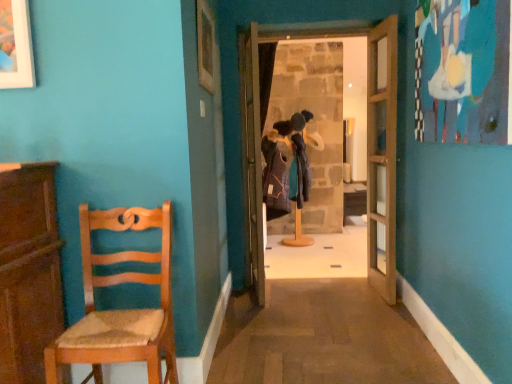
Question: Considering the relative sizes of wooden door at center, the 1th door from the right, and wooden table at center in the image provided, is wooden door at center, the 1th door from the right, bigger than wooden table at center?

Choices:
 (A) no
 (B) yes

Answer: (A)

Question: Is wooden door at center, the 1th door from the right, to the right of wooden table at center from the viewer's perspective?

Choices:
 (A) yes
 (B) no

Answer: (B)

Question: Does wooden door at center, the 1th door from the right, have a greater height compared to wooden table at center?

Choices:
 (A) no
 (B) yes

Answer: (B)

Question: Could wooden table at center be considered to be inside wooden door at center, the 1th door from the right?

Choices:
 (A) no
 (B) yes

Answer: (A)

Question: Does wooden door at center, the 1th door from the right, come in front of wooden table at center?

Choices:
 (A) yes
 (B) no

Answer: (A)

Question: Would you say woven wood chair at left is inside or outside wooden picture frame at upper center?

Choices:
 (A) outside
 (B) inside

Answer: (A)

Question: Considering their positions, is woven wood chair at left located in front of or behind wooden picture frame at upper center?

Choices:
 (A) front
 (B) behind

Answer: (A)

Question: Looking at their shapes, would you say woven wood chair at left is wider or thinner than wooden picture frame at upper center?

Choices:
 (A) wide
 (B) thin

Answer: (A)

Question: In terms of height, does woven wood chair at left look taller or shorter compared to wooden picture frame at upper center?

Choices:
 (A) tall
 (B) short

Answer: (A)

Question: Is wooden picture frame at upper center bigger or smaller than woven wood chair at left?

Choices:
 (A) big
 (B) small

Answer: (B)

Question: From a real-world perspective, relative to woven wood chair at left, is wooden picture frame at upper center vertically above or below?

Choices:
 (A) below
 (B) above

Answer: (B)

Question: Is wooden picture frame at upper center in front of or behind woven wood chair at left in the image?

Choices:
 (A) behind
 (B) front

Answer: (A)

Question: From the image's perspective, is wooden picture frame at upper center above or below woven wood chair at left?

Choices:
 (A) below
 (B) above

Answer: (B)

Question: From a real-world perspective, is wooden table at center above or below wooden picture frame at upper center?

Choices:
 (A) below
 (B) above

Answer: (A)

Question: In the image, is wooden table at center positioned in front of or behind wooden picture frame at upper center?

Choices:
 (A) front
 (B) behind

Answer: (B)